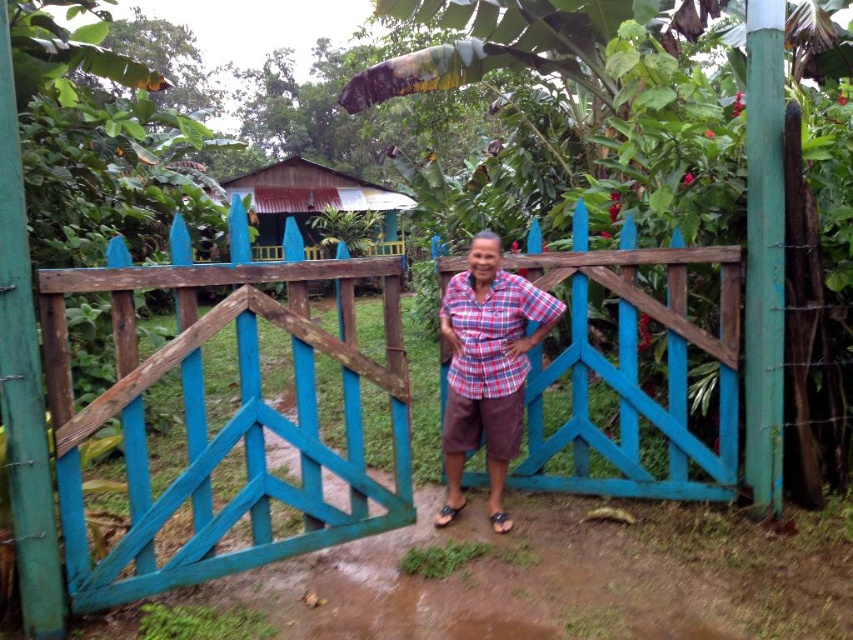
Question: Does teal wooden gate at center appear over plaid fabric shirt at center?

Choices:
 (A) yes
 (B) no

Answer: (B)

Question: Among these points, which one is farthest from the camera?

Choices:
 (A) (454, 509)
 (B) (296, 189)
 (C) (503, 432)
 (D) (637, 417)

Answer: (B)

Question: Can you confirm if teal wooden gate at center is thinner than rusty metal hut at center?

Choices:
 (A) yes
 (B) no

Answer: (A)

Question: Which point is closer to the camera?

Choices:
 (A) (276, 198)
 (B) (181, 304)
 (C) (462, 508)

Answer: (B)

Question: Which of the following is the closest to the observer?

Choices:
 (A) wooden gate at center
 (B) brown leather sandal at lower center
 (C) teal wooden gate at center

Answer: (C)

Question: Can you confirm if teal wooden gate at center is positioned to the right of rusty metal hut at center?

Choices:
 (A) yes
 (B) no

Answer: (A)